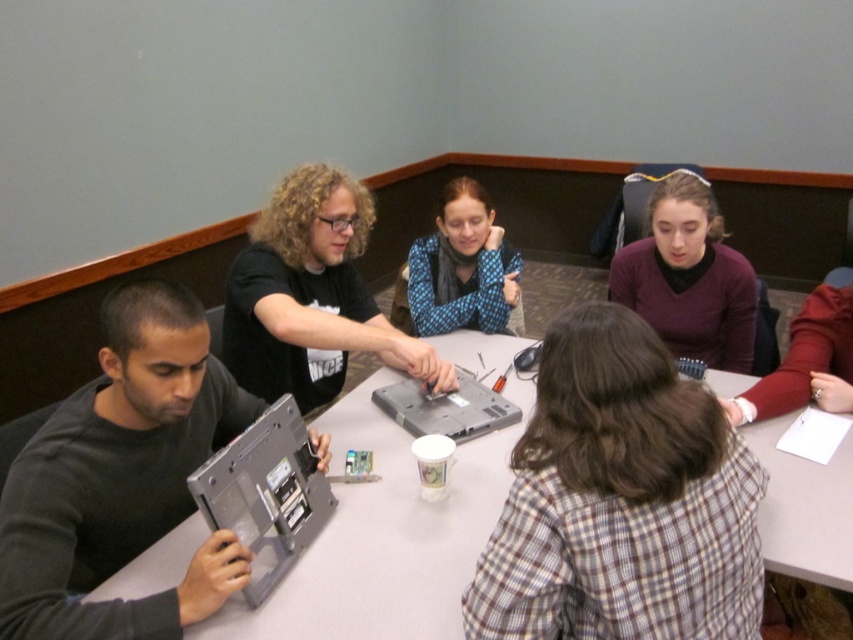
Between point (383, 572) and point (308, 465), which one is positioned in front?

Point (383, 572) is in front.

Can you confirm if gray plastic table at center is bigger than gray metallic laptop at lower left?

Yes.

Where is `gray plastic table at center`? Image resolution: width=853 pixels, height=640 pixels. gray plastic table at center is located at coordinates (386, 538).

Between point (685, 246) and point (480, 308), which one is positioned in front?

Point (685, 246) is more forward.

From the picture: Which is more to the right, matte purple sweater at center or blue dotted sweater at center?

matte purple sweater at center

Is point (698, 193) farther from camera compared to point (433, 276)?

That is False.

The width and height of the screenshot is (853, 640). Find the location of `matte purple sweater at center`. matte purple sweater at center is located at coordinates (689, 278).

Is gray metallic laptop at lower left taller than blue dotted sweater at center?

No.

Is point (248, 486) farther from camera compared to point (445, 292)?

That is False.

This screenshot has width=853, height=640. Find the location of `gray metallic laptop at lower left`. gray metallic laptop at lower left is located at coordinates (265, 493).